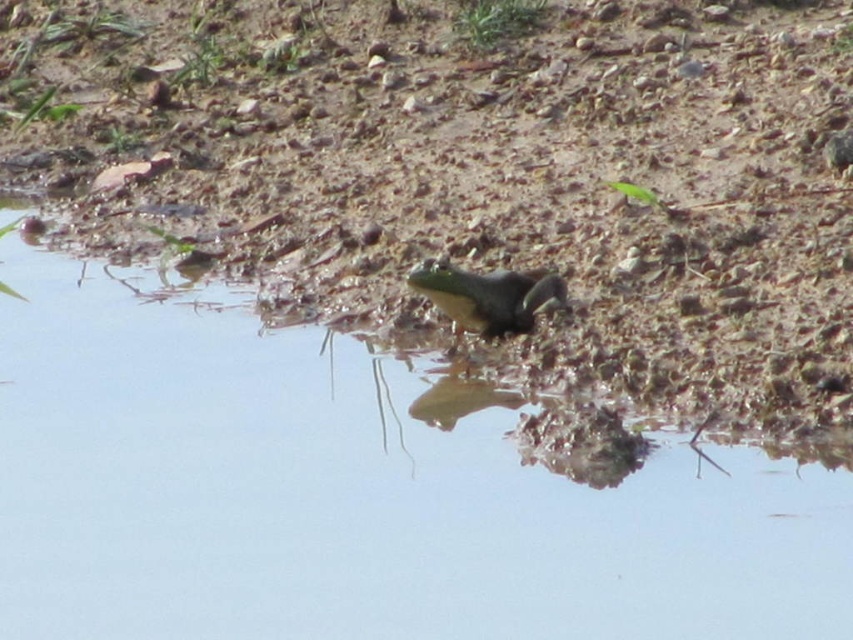
Question: Is green matte frog at center positioned behind green matte lizard at center?

Choices:
 (A) no
 (B) yes

Answer: (A)

Question: Which of the following is the closest to the observer?

Choices:
 (A) dull brown dirt at center
 (B) green matte lizard at center

Answer: (A)

Question: Can you confirm if dull brown dirt at center is wider than green matte frog at center?

Choices:
 (A) no
 (B) yes

Answer: (B)

Question: Is green matte frog at center below green matte lizard at center?

Choices:
 (A) yes
 (B) no

Answer: (A)

Question: Which point is farther to the camera?

Choices:
 (A) green matte frog at center
 (B) dull brown dirt at center
 (C) green matte lizard at center

Answer: (C)

Question: Considering the real-world distances, which object is closest to the green matte frog at center?

Choices:
 (A) green matte lizard at center
 (B) dull brown dirt at center

Answer: (A)